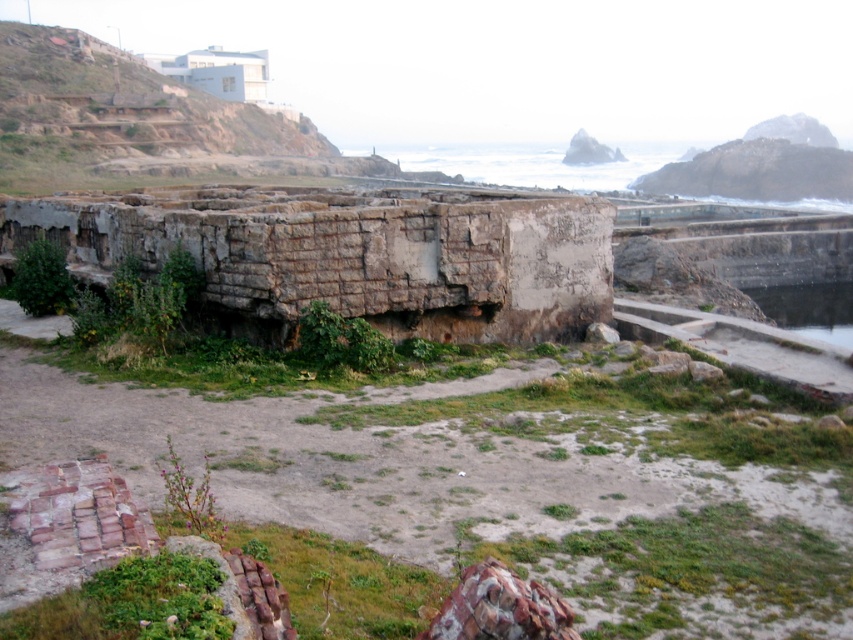
You are standing at the point labeled point (523, 288) and want to walk to the point labeled point (773, 305). Which direction should you face to move towards it?

You should face downward because point (773, 305) is further away from the camera compared to point (523, 288).

You are standing at the edge of the coastal scene and want to reach the clear water at lower right. Based on the image, is the rusty concrete ruins at center blocking your path to the water?

The rusty concrete ruins at center is located above clear water at lower right, so it is blocking your path to the water.

You are standing in the coastal area and want to cross from the rusty concrete ruins at center to the clear water at lower right. Is the path between them safe to walk on?

The rusty concrete ruins at center is closer to the viewer than clear water at lower right, so the path between them may be uneven and unstable due to the scattered small rocks and uneven ground mentioned in the scene description. Proceed with caution.